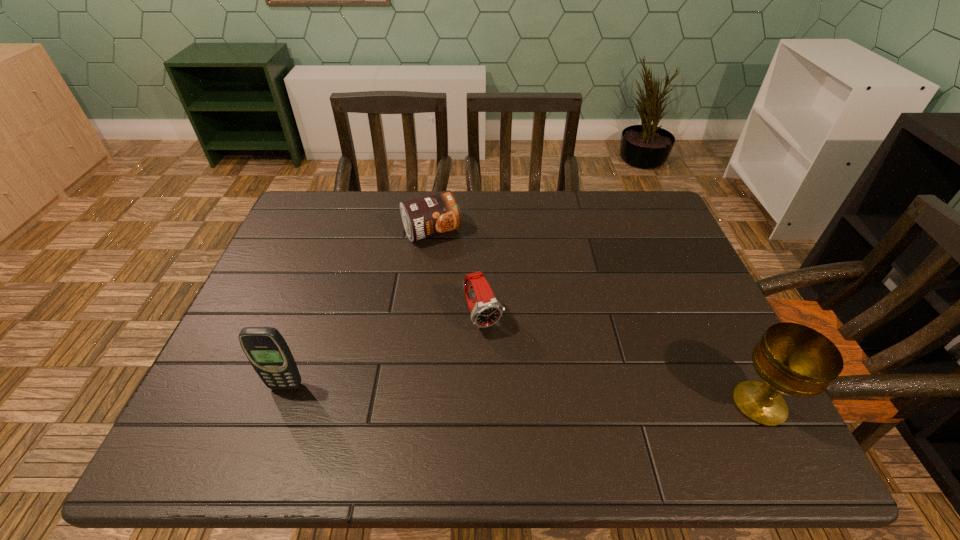
Where is `object located at the near right corner`? This screenshot has width=960, height=540. object located at the near right corner is located at coordinates point(793,359).

Where is `vacant space at the far edge of the desktop`? This screenshot has width=960, height=540. vacant space at the far edge of the desktop is located at coordinates (478, 206).

At what (x,y) coordinates should I click in order to perform the action: click on vacant space at the near edge of the desktop. Please return your answer as a coordinate pair (x, y). The height and width of the screenshot is (540, 960). Looking at the image, I should click on (474, 389).

Find the location of `free spot at the left edge of the desktop`. free spot at the left edge of the desktop is located at coordinates (276, 311).

Locate an element on the screen. Image resolution: width=960 pixels, height=540 pixels. vacant region at the right edge of the desktop is located at coordinates (x=655, y=240).

Where is `free space at the far left corner of the desktop`? free space at the far left corner of the desktop is located at coordinates (296, 211).

Locate an element on the screen. The height and width of the screenshot is (540, 960). free region at the far right corner of the desktop is located at coordinates (634, 219).

The width and height of the screenshot is (960, 540). Identify the location of free space between the leftmost object and the rightmost object. point(522,395).

Where is `blank region between the leftmost object and the second object from left to right`? This screenshot has height=540, width=960. blank region between the leftmost object and the second object from left to right is located at coordinates pos(359,309).

Identify the location of vacant area that lies between the farthest object and the rightmost object. (595, 318).